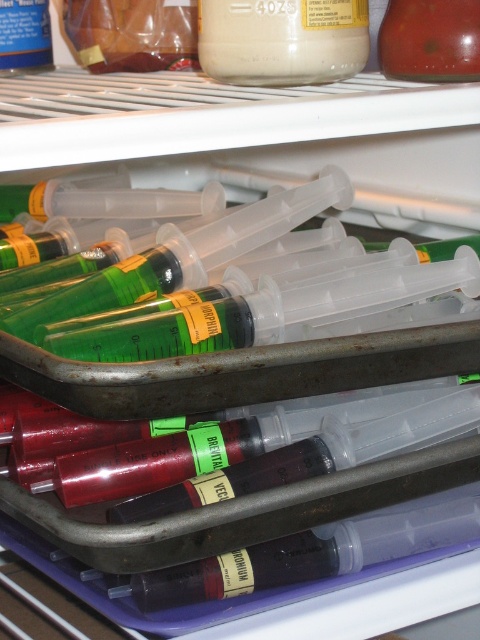
Between translucent plastic bottles at upper left and shiny red apple at upper right, which one appears on the left side from the viewer's perspective?

From the viewer's perspective, translucent plastic bottles at upper left appears more on the left side.

Which is below, translucent plastic bottles at upper left or shiny red apple at upper right?

shiny red apple at upper right is below.

Locate an element on the screen. translucent plastic bottles at upper left is located at coordinates (132, 33).

Does translucent plastic bottles at upper left appear on the right side of translucent plastic bottle at upper left?

Correct, you'll find translucent plastic bottles at upper left to the right of translucent plastic bottle at upper left.

Is translucent plastic bottles at upper left positioned before translucent plastic bottle at upper left?

No, translucent plastic bottles at upper left is further to the viewer.

The image size is (480, 640). Describe the element at coordinates (132, 33) in the screenshot. I see `translucent plastic bottles at upper left` at that location.

Where is `translucent plastic bottles at upper left`? The width and height of the screenshot is (480, 640). translucent plastic bottles at upper left is located at coordinates (132, 33).

Is shiny red apple at upper right to the left of translucent plastic bottle at upper left from the viewer's perspective?

In fact, shiny red apple at upper right is to the right of translucent plastic bottle at upper left.

Which is more to the left, shiny red apple at upper right or translucent plastic bottle at upper left?

From the viewer's perspective, translucent plastic bottle at upper left appears more on the left side.

At what (x,y) coordinates should I click in order to perform the action: click on shiny red apple at upper right. Please return your answer as a coordinate pair (x, y). The height and width of the screenshot is (640, 480). Looking at the image, I should click on (431, 40).